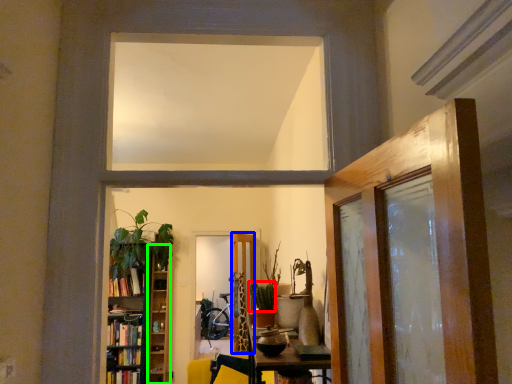
Question: Which object is the closest to the plant (highlighted by a red box)? Choose among these: door (highlighted by a blue box) or shelf (highlighted by a green box).

Choices:
 (A) door
 (B) shelf

Answer: (A)